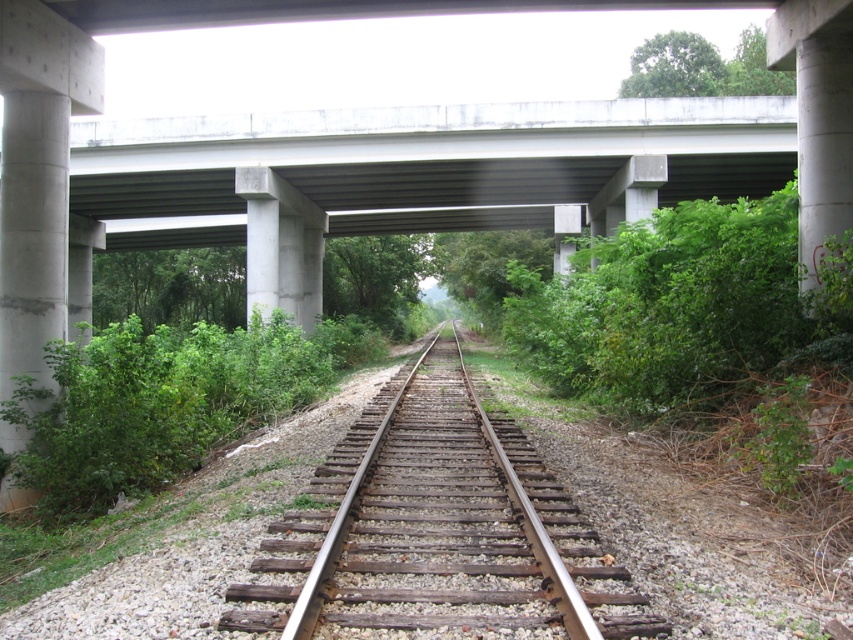
This screenshot has width=853, height=640. Describe the element at coordinates (440, 518) in the screenshot. I see `rusty metal train track at center` at that location.

Does rusty metal train track at center have a larger size compared to concrete at center?

Actually, rusty metal train track at center might be smaller than concrete at center.

Is point (302, 589) positioned in front of point (311, 280)?

Yes, it is.

Where is `rusty metal train track at center`? The width and height of the screenshot is (853, 640). rusty metal train track at center is located at coordinates (440, 518).

Between concrete at left and concrete at center, which one has less height?

concrete at left

Between point (16, 232) and point (276, 193), which one is positioned in front?

Positioned in front is point (16, 232).

Describe the element at coordinates (38, 177) in the screenshot. The width and height of the screenshot is (853, 640). I see `concrete at left` at that location.

The width and height of the screenshot is (853, 640). Find the location of `concrete at left`. concrete at left is located at coordinates (38, 177).

Can you confirm if rusty metal train track at center is taller than concrete at left?

Incorrect, rusty metal train track at center's height is not larger of concrete at left's.

Does rusty metal train track at center have a lesser width compared to concrete at left?

No, rusty metal train track at center is not thinner than concrete at left.

Does point (430, 516) come behind point (45, 145)?

No, it is in front of (45, 145).

This screenshot has height=640, width=853. Find the location of `rusty metal train track at center`. rusty metal train track at center is located at coordinates (440, 518).